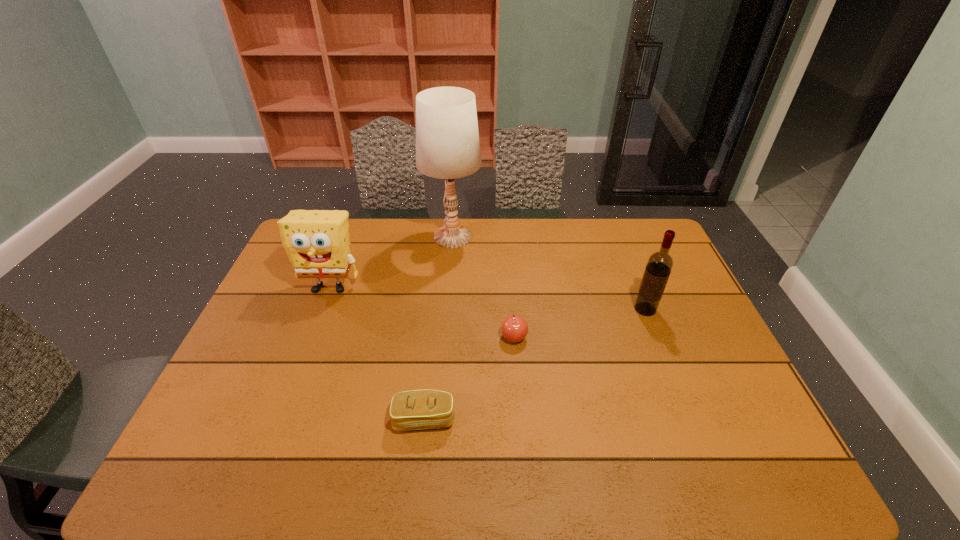
Identify the location of the farthest object. This screenshot has height=540, width=960. (447, 138).

Locate an element on the screen. The width and height of the screenshot is (960, 540). lamp is located at coordinates (447, 138).

Where is `wine bottle`? wine bottle is located at coordinates (659, 265).

You are a GUI agent. You are given a task and a screenshot of the screen. Output one action in this format:
    pyautogui.click(x=<x>, y=<y>)
    Task: Click on the leftmost object
    The image size is (960, 540).
    Given the screenshot: What is the action you would take?
    point(317,243)

Locate an element on the screen. The image size is (960, 540). the fourth object from left to right is located at coordinates (514, 329).

Find the location of `the second nearest object`. the second nearest object is located at coordinates (514, 329).

At what (x,y) coordinates should I click in order to perform the action: click on clutch bag. Please return your answer as a coordinate pair (x, y). The image size is (960, 540). Looking at the image, I should click on (417, 409).

Locate an element on the screen. The height and width of the screenshot is (540, 960). the shortest object is located at coordinates (417, 409).

Identify the location of free space located on the left of the farthest object. Image resolution: width=960 pixels, height=540 pixels. (355, 237).

The height and width of the screenshot is (540, 960). I want to click on blank area located 0.210m on the left of the wine bottle, so click(564, 309).